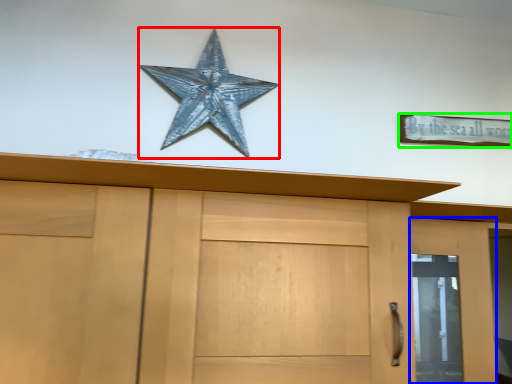
Question: Estimate the real-world distances between objects in this image. Which object is closer to starfish (highlighted by a red box), door (highlighted by a blue box) or magnet (highlighted by a green box)?

Choices:
 (A) door
 (B) magnet

Answer: (B)